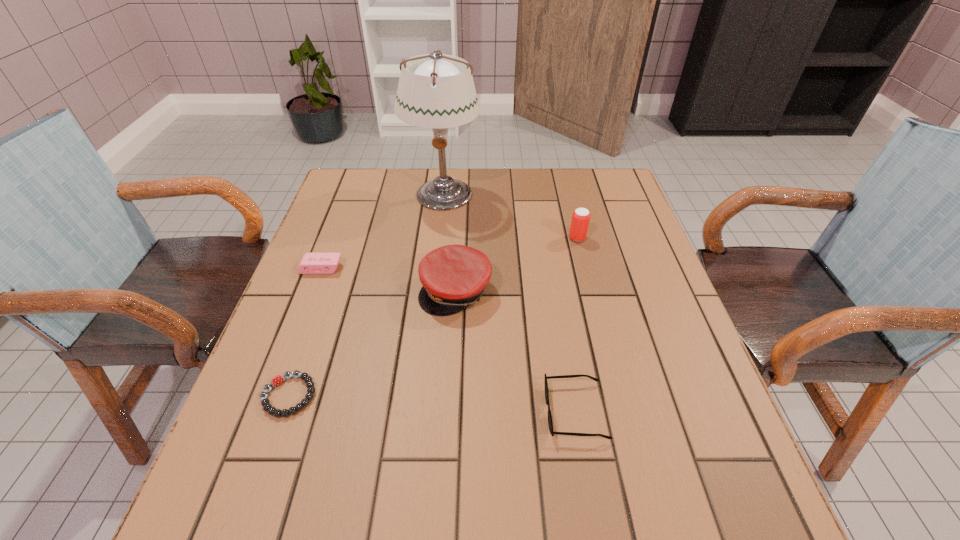
What are the coordinates of `free space located at the front of the cap where the visor is located` in the screenshot? It's located at (450, 383).

Image resolution: width=960 pixels, height=540 pixels. Find the location of `free space located 0.260m on the back of the eraser`. free space located 0.260m on the back of the eraser is located at coordinates (346, 203).

Where is `vacant area situated on the front-facing side of the sunglasses`? vacant area situated on the front-facing side of the sunglasses is located at coordinates (450, 411).

Locate an element on the screen. vacant space located 0.250m on the front-facing side of the sunglasses is located at coordinates (413, 411).

Locate an element on the screen. The height and width of the screenshot is (540, 960). free location located 0.200m on the front-facing side of the sunglasses is located at coordinates (440, 411).

Where is `free space located on the back of the bracelet`? free space located on the back of the bracelet is located at coordinates (314, 323).

The height and width of the screenshot is (540, 960). What are the coordinates of `object that is at the far edge` in the screenshot? It's located at (435, 90).

In order to click on eraser at the left edge in this screenshot , I will do `click(311, 263)`.

This screenshot has height=540, width=960. What are the coordinates of `bracelet at the left edge` in the screenshot? It's located at (267, 407).

What are the coordinates of `object that is at the right edge` in the screenshot? It's located at (580, 220).